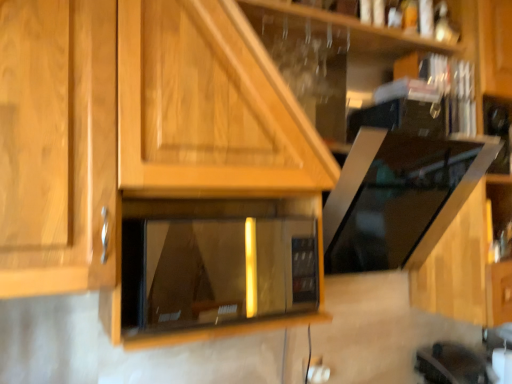
Question: Would you say wooden at upper center is inside or outside matte black microwave at center?

Choices:
 (A) inside
 (B) outside

Answer: (B)

Question: Visually, is wooden at upper center positioned to the left or to the right of matte black microwave at center?

Choices:
 (A) right
 (B) left

Answer: (A)

Question: Considering the real-world distances, which object is farthest from the wooden at upper center?

Choices:
 (A) white plastic electric outlet at lower center
 (B) matte black microwave at center

Answer: (B)

Question: Which of these objects is positioned farthest from the matte black microwave at center?

Choices:
 (A) wooden at upper center
 (B) white plastic electric outlet at lower center

Answer: (B)